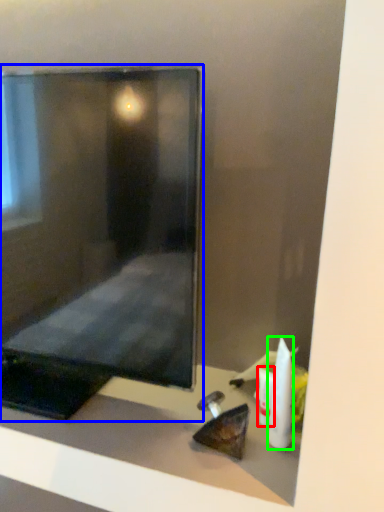
Question: Considering the real-world distances, which object is closest to toiletry (highlighted by a red box)? computer monitor (highlighted by a blue box) or toiletry (highlighted by a green box).

Choices:
 (A) computer monitor
 (B) toiletry

Answer: (B)